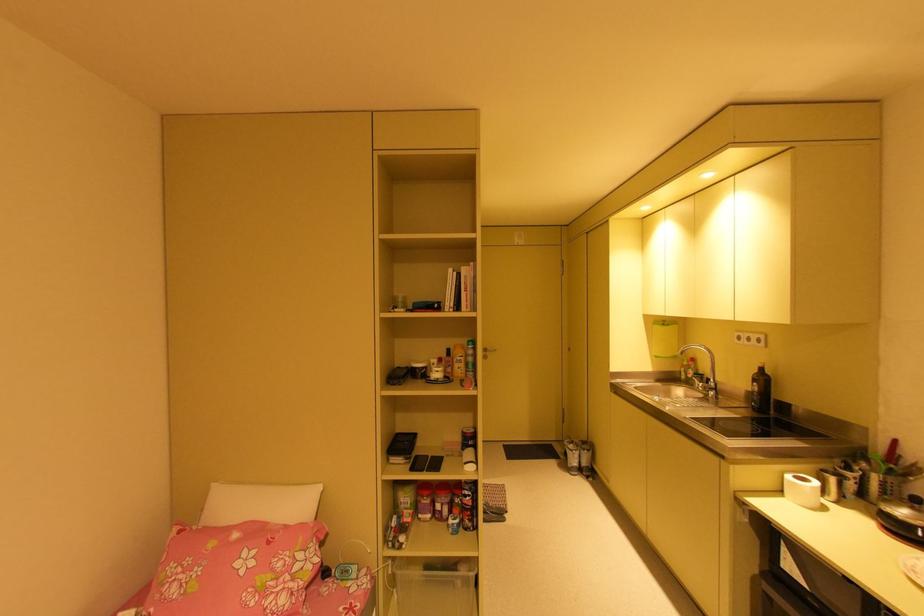
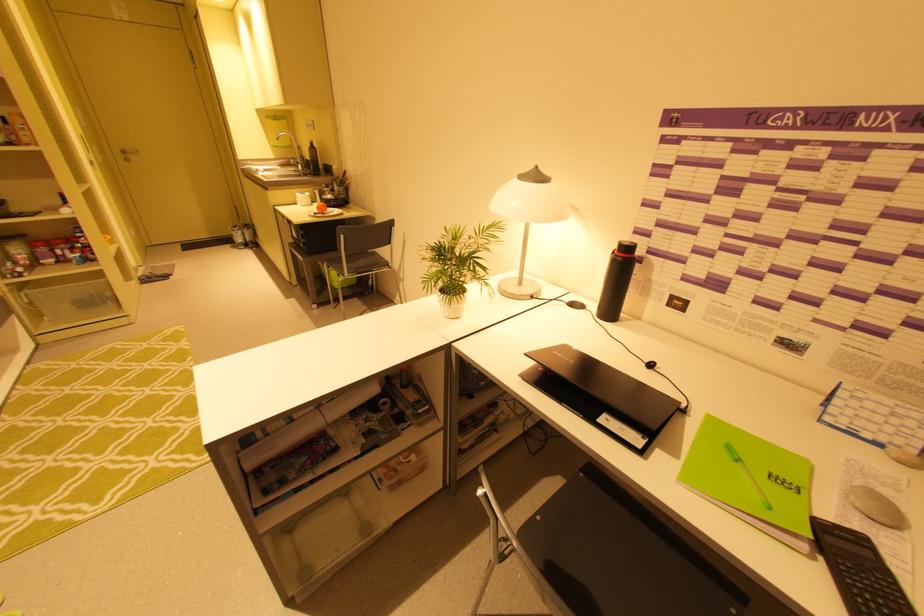
Where in the second image is the point corresponding to point (760, 371) from the first image?

(313, 146)